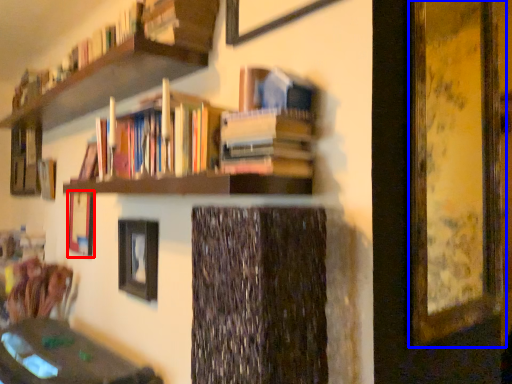
Question: Which object is closer to the camera taking this photo, picture frame (highlighted by a red box) or picture frame (highlighted by a blue box)?

Choices:
 (A) picture frame
 (B) picture frame

Answer: (B)